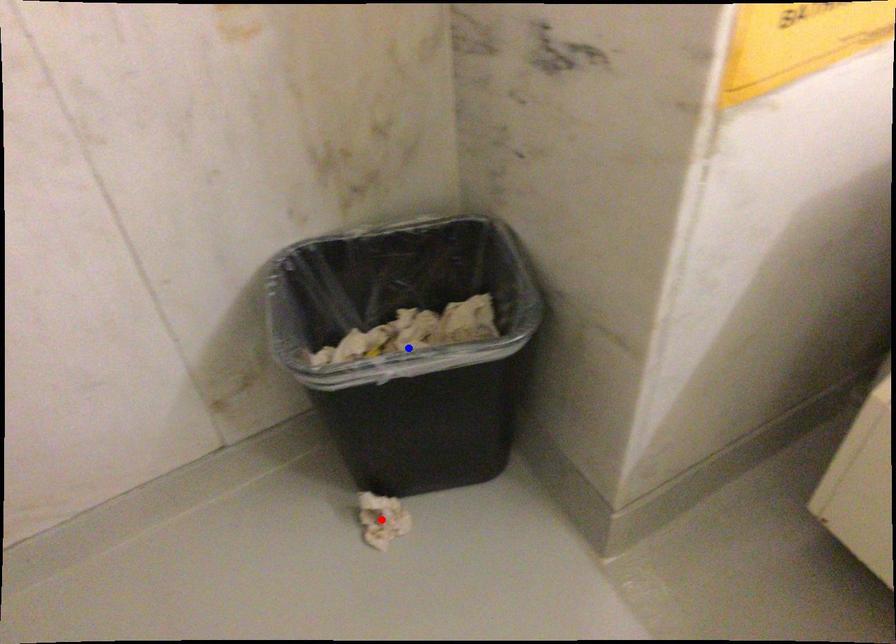
Question: In the image, two points are highlighted. Which point is nearer to the camera? Reply with the corresponding letter.

Choices:
 (A) blue point
 (B) red point

Answer: (A)